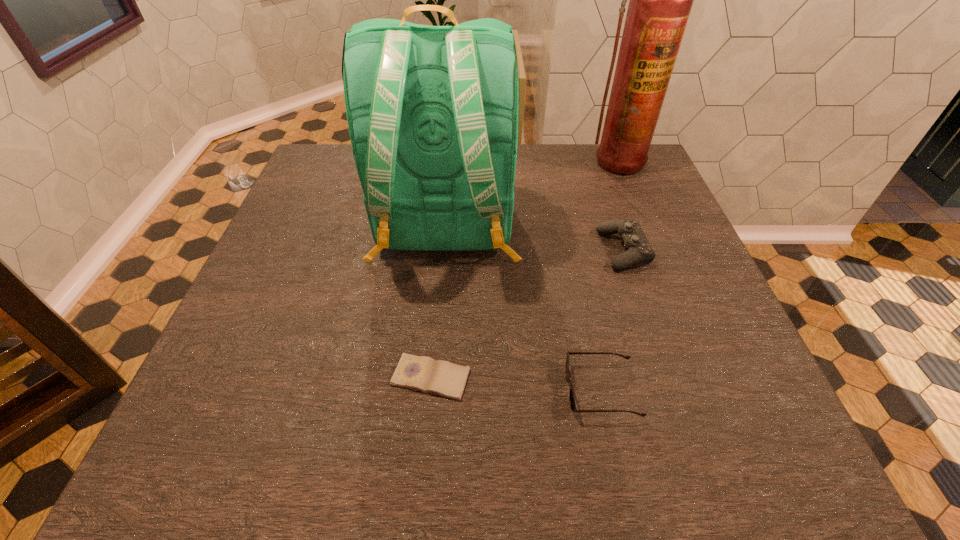
Image resolution: width=960 pixels, height=540 pixels. In order to click on empty space that is in between the third object from right to left and the third shortest object in this screenshot , I will do `click(612, 321)`.

This screenshot has width=960, height=540. I want to click on unoccupied area between the second shortest object and the fire extinguisher, so click(x=609, y=276).

You are a GUI agent. You are given a task and a screenshot of the screen. Output one action in this format:
    pyautogui.click(x=<x>, y=<y>)
    Task: Click on the object that is the fourth nearest to the shortest object
    This screenshot has height=540, width=960.
    Given the screenshot: What is the action you would take?
    pyautogui.click(x=660, y=0)

Select which object appears as the closest to the sunglasses. Please provide its 2D coordinates. Your answer should be formatted as a tuple, i.e. [(x, y)], where the tuple contains the x and y coordinates of a point satisfying the conditions above.

[(422, 373)]

Image resolution: width=960 pixels, height=540 pixels. Find the location of `blank area in the image that satisfies the following two spatial constraints: 1. on the front side of the third shortest object; 2. on the front lenses of the third object from right to left`. blank area in the image that satisfies the following two spatial constraints: 1. on the front side of the third shortest object; 2. on the front lenses of the third object from right to left is located at coordinates (x=670, y=391).

The height and width of the screenshot is (540, 960). What are the coordinates of `free space that satisfies the following two spatial constraints: 1. on the back of the backpack; 2. on the right side of the third shortest object` in the screenshot? It's located at (444, 251).

Where is `vacant space that satisfies the following two spatial constraints: 1. on the back of the backpack; 2. on the right side of the control`? This screenshot has height=540, width=960. vacant space that satisfies the following two spatial constraints: 1. on the back of the backpack; 2. on the right side of the control is located at coordinates (444, 251).

I want to click on free spot that satisfies the following two spatial constraints: 1. on the side of the fire extinguisher with the label; 2. on the front lenses of the second shortest object, so click(x=706, y=391).